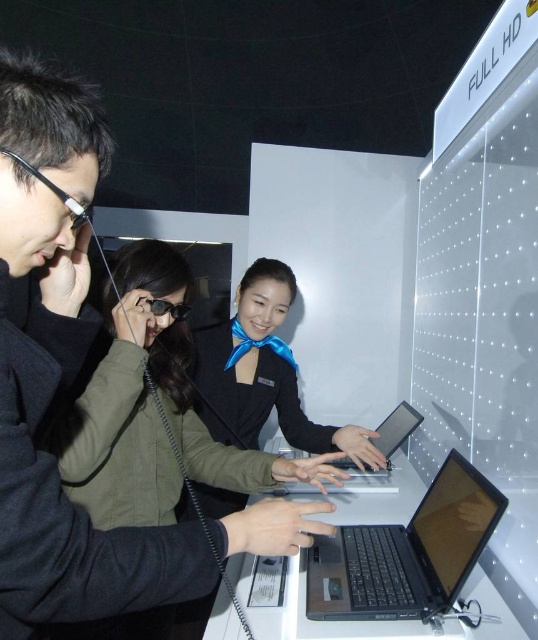
Question: Can you confirm if black fabric uniform at center is positioned below satin black tablet at center?

Choices:
 (A) no
 (B) yes

Answer: (A)

Question: Which point appears farthest from the camera in this image?

Choices:
 (A) (258, 387)
 (B) (75, 508)
 (C) (410, 410)
 (D) (476, 529)

Answer: (C)

Question: Which of the following is the closest to the observer?

Choices:
 (A) (200, 412)
 (B) (398, 412)
 (C) (349, 460)

Answer: (A)

Question: Which point appears closest to the camera in this image?

Choices:
 (A) (74, 552)
 (B) (443, 524)
 (C) (269, 410)
 (D) (407, 424)

Answer: (A)

Question: Can you confirm if matte black laptop at center is bigger than silver metallic laptop at center?

Choices:
 (A) yes
 (B) no

Answer: (A)

Question: Can you confirm if matte black laptop at center is smaller than satin black tablet at center?

Choices:
 (A) yes
 (B) no

Answer: (B)